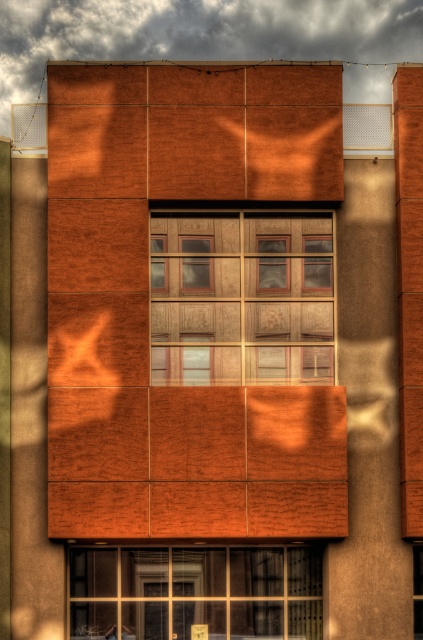
You are an architect designing a new building. You want to install a decorative light between the two wooden windows at center. What is the minimum distance the light should be able to span to fit between them?

The wooden windows at center are 33.21 meters apart, so the light should be able to span at least 33.21 meters to fit between them.

You are an architect designing a new building and want to ensure that the wooden windows at center and clear glass window at lower center align properly with the building structure. Given their widths, which window should be placed in a space that requires more horizontal space?

The clear glass window at lower center should be placed in the space requiring more horizontal space because it has a greater width than the wooden windows at center.

In the scene shown: You are standing in front of the building and want to locate the wooden windows at center. Can you tell me their exact 2D coordinates based on the image?

The wooden windows at center are located at the 2D coordinates of point [241,298].